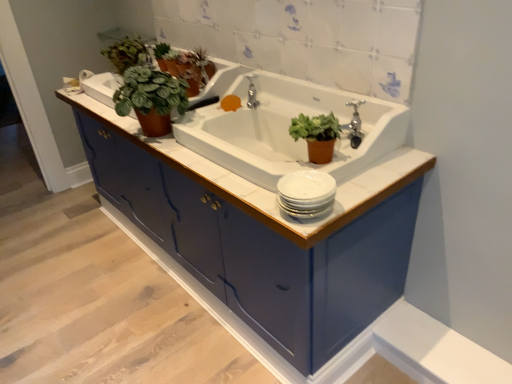
What is the approximate width of white glossy sink at center?

It is 48.31 centimeters.

Find the location of a particular element. The width and height of the screenshot is (512, 384). silver metallic tap at upper center is located at coordinates (252, 94).

At what (x,y) coordinates should I click in order to perform the action: click on matte brown pot at center, arranged as the first houseplant when viewed from the right. Please return your answer as a coordinate pair (x, y). Image resolution: width=512 pixels, height=384 pixels. Looking at the image, I should click on (317, 135).

The height and width of the screenshot is (384, 512). What do you see at coordinates (151, 98) in the screenshot? I see `green matte plant at upper left, the 2th houseplant positioned from the front` at bounding box center [151, 98].

Locate an element on the screen. The width and height of the screenshot is (512, 384). matte blue cabinet at center is located at coordinates (265, 189).

In the scene shown: Measure the distance between green matte plant at upper center and camera.

green matte plant at upper center is 1.78 meters away from camera.

The width and height of the screenshot is (512, 384). What do you see at coordinates (201, 64) in the screenshot?
I see `green matte plant at upper center` at bounding box center [201, 64].

I want to click on matte ceramic sink at center, so click(x=100, y=86).

Identify the location of white glossy sink at center. (287, 130).

Considering the positions of objects silver metallic tap at upper center and matte blue cabinet at center in the image provided, who is behind, silver metallic tap at upper center or matte blue cabinet at center?

silver metallic tap at upper center is behind.

Is silver metallic tap at upper center completely or partially outside of matte blue cabinet at center?

silver metallic tap at upper center is positioned outside matte blue cabinet at center.

Considering the positions of objects silver metallic tap at upper center and matte blue cabinet at center in the image provided, who is more to the left, silver metallic tap at upper center or matte blue cabinet at center?

matte blue cabinet at center.

Is point (250, 101) closer to viewer compared to point (105, 121)?

That is True.

Can you confirm if matte brown pot at center, which appears as the third houseplant when viewed from the back, is shorter than green matte plant at upper left, the 2th houseplant from the back?

Yes, matte brown pot at center, which appears as the third houseplant when viewed from the back, is shorter than green matte plant at upper left, the 2th houseplant from the back.

How many degrees apart are the facing directions of matte brown pot at center, the first houseplant in the front-to-back sequence, and green matte plant at upper left, which appears as the 2th houseplant when viewed from the top?

The angular difference between matte brown pot at center, the first houseplant in the front-to-back sequence, and green matte plant at upper left, which appears as the 2th houseplant when viewed from the top, is 1.41 degrees.

Would you say matte brown pot at center, arranged as the first houseplant when viewed from the right, is outside green matte plant at upper left, the 2th houseplant from the back?

matte brown pot at center, arranged as the first houseplant when viewed from the right, is positioned outside green matte plant at upper left, the 2th houseplant from the back.

Which object is closer to the camera, matte brown pot at center, the 1th houseplant from the bottom, or green matte plant at upper left, which appears as the 2th houseplant when viewed from the top?

matte brown pot at center, the 1th houseplant from the bottom, is more forward.

Does matte brown pot at center, the 1th houseplant from the bottom, turn towards matte ceramic sink at center?

No, matte brown pot at center, the 1th houseplant from the bottom, is not turned towards matte ceramic sink at center.

Which object is closer to the camera taking this photo, matte brown pot at center, which is the 3th houseplant from left to right, or matte ceramic sink at center?

matte brown pot at center, which is the 3th houseplant from left to right, is closer to the camera.

Based on their sizes in the image, would you say matte brown pot at center, arranged as the first houseplant when viewed from the right, is bigger or smaller than matte ceramic sink at center?

matte brown pot at center, arranged as the first houseplant when viewed from the right, is smaller than matte ceramic sink at center.

Is green matte plant at upper left, acting as the 3th houseplant starting from the right, at the left side of green matte plant at upper center?

Indeed, green matte plant at upper left, acting as the 3th houseplant starting from the right, is positioned on the left side of green matte plant at upper center.

From the picture: Which of these two, green matte plant at upper left, placed as the 1th houseplant when sorted from back to front, or green matte plant at upper center, is bigger?

Bigger between the two is green matte plant at upper left, placed as the 1th houseplant when sorted from back to front.

How much distance is there between green matte plant at upper left, the third houseplant positioned from the bottom, and green matte plant at upper center?

green matte plant at upper left, the third houseplant positioned from the bottom, is 13.00 inches away from green matte plant at upper center.

Is green matte plant at upper left, the first houseplant in the left-to-right sequence, next to green matte plant at upper center?

No, green matte plant at upper left, the first houseplant in the left-to-right sequence, is not beside green matte plant at upper center.

Could silver metallic tap at upper center be considered to be inside matte brown pot at center, which appears as the third houseplant when viewed from the back?

No, silver metallic tap at upper center is not a part of matte brown pot at center, which appears as the third houseplant when viewed from the back.

This screenshot has width=512, height=384. Find the location of `tap on the left of matte brown pot at center, arranged as the first houseplant when viewed from the right`. tap on the left of matte brown pot at center, arranged as the first houseplant when viewed from the right is located at coordinates (252, 94).

From a real-world perspective, is matte brown pot at center, which is counted as the 3th houseplant, starting from the top, physically above silver metallic tap at upper center?

Indeed, from a real-world perspective, matte brown pot at center, which is counted as the 3th houseplant, starting from the top, stands above silver metallic tap at upper center.

Is green matte plant at upper center placed right next to silver metallic tap at upper center?

No.

The height and width of the screenshot is (384, 512). I want to click on plant above the silver metallic tap at upper center (from a real-world perspective), so click(x=201, y=64).

Looking at the image, does green matte plant at upper center seem bigger or smaller compared to silver metallic tap at upper center?

Considering their sizes, green matte plant at upper center takes up more space than silver metallic tap at upper center.

From a real-world perspective, is green matte plant at upper center over silver metallic tap at upper center?

Yes, from a real-world perspective, green matte plant at upper center is above silver metallic tap at upper center.

Between green matte plant at upper left, which ranks as the 2th houseplant in bottom-to-top order, and matte blue cabinet at center, which one appears on the right side from the viewer's perspective?

matte blue cabinet at center.

Considering the sizes of objects green matte plant at upper left, which ranks as the second houseplant in left-to-right order, and matte blue cabinet at center in the image provided, who is taller, green matte plant at upper left, which ranks as the second houseplant in left-to-right order, or matte blue cabinet at center?

matte blue cabinet at center is taller.

Relative to matte blue cabinet at center, is green matte plant at upper left, the 2th houseplant in the right-to-left sequence, in front or behind?

green matte plant at upper left, the 2th houseplant in the right-to-left sequence, is behind matte blue cabinet at center.

Consider the image. Are green matte plant at upper left, the 2th houseplant positioned from the front, and matte blue cabinet at center located far from each other?

green matte plant at upper left, the 2th houseplant positioned from the front, is near matte blue cabinet at center, not far away.

This screenshot has height=384, width=512. In order to click on bathroom cabinet on the left of silver metallic tap at upper center in this screenshot , I will do `click(265, 189)`.

Where is `houseplant below the green matte plant at upper left, which ranks as the second houseplant in left-to-right order (from a real-world perspective)`? This screenshot has height=384, width=512. houseplant below the green matte plant at upper left, which ranks as the second houseplant in left-to-right order (from a real-world perspective) is located at coordinates (317, 135).

From the image, which object appears to be farther from green matte plant at upper center, matte ceramic sink at center or green matte plant at upper left, which ranks as the second houseplant in left-to-right order?

Among the two, matte ceramic sink at center is located further to green matte plant at upper center.

From the image, which object appears to be nearer to green matte plant at upper center, silver metallic tap at upper center or green matte plant at upper left, the first houseplant in the top-to-bottom sequence?

Based on the image, silver metallic tap at upper center appears to be nearer to green matte plant at upper center.

From the image, which object appears to be farther from matte ceramic sink at center, white glossy sink at center or green matte plant at upper center?

Among the two, white glossy sink at center is located further to matte ceramic sink at center.

Looking at the image, which one is located closer to matte brown pot at center, the first houseplant in the front-to-back sequence, green matte plant at upper center or green matte plant at upper left, which appears as the 2th houseplant when viewed from the top?

green matte plant at upper left, which appears as the 2th houseplant when viewed from the top, lies closer to matte brown pot at center, the first houseplant in the front-to-back sequence, than the other object.

Which object lies nearer to the anchor point green matte plant at upper left, which is counted as the 3th houseplant, starting from the front, green matte plant at upper center or silver metallic tap at upper center?

Among the two, green matte plant at upper center is located nearer to green matte plant at upper left, which is counted as the 3th houseplant, starting from the front.

Looking at the image, which one is located closer to matte blue cabinet at center, green matte plant at upper left, which is counted as the 3th houseplant, starting from the front, or green matte plant at upper left, which ranks as the second houseplant in left-to-right order?

green matte plant at upper left, which ranks as the second houseplant in left-to-right order, is positioned closer to the anchor matte blue cabinet at center.

Based on their spatial positions, is green matte plant at upper left, which is counted as the 3th houseplant, starting from the front, or green matte plant at upper center further from matte brown pot at center, arranged as the first houseplant when viewed from the right?

Based on the image, green matte plant at upper left, which is counted as the 3th houseplant, starting from the front, appears to be further to matte brown pot at center, arranged as the first houseplant when viewed from the right.

From the image, which object appears to be nearer to matte ceramic sink at center, matte brown pot at center, which appears as the third houseplant when viewed from the back, or green matte plant at upper left, acting as the 3th houseplant starting from the right?

Among the two, green matte plant at upper left, acting as the 3th houseplant starting from the right, is located nearer to matte ceramic sink at center.

Image resolution: width=512 pixels, height=384 pixels. I want to click on bath positioned between green matte plant at upper left, the 2th houseplant positioned from the front, and green matte plant at upper center from near to far, so click(x=100, y=86).

Image resolution: width=512 pixels, height=384 pixels. Find the location of `sink between green matte plant at upper left, which ranks as the 2th houseplant in bottom-to-top order, and matte brown pot at center, which is counted as the 3th houseplant, starting from the top, from left to right`. sink between green matte plant at upper left, which ranks as the 2th houseplant in bottom-to-top order, and matte brown pot at center, which is counted as the 3th houseplant, starting from the top, from left to right is located at coordinates (287, 130).

The width and height of the screenshot is (512, 384). Find the location of `bathroom cabinet between green matte plant at upper left, which ranks as the 2th houseplant in bottom-to-top order, and white glossy sink at center`. bathroom cabinet between green matte plant at upper left, which ranks as the 2th houseplant in bottom-to-top order, and white glossy sink at center is located at coordinates (265, 189).

Locate an element on the screen. tap between matte brown pot at center, arranged as the first houseplant when viewed from the right, and green matte plant at upper center in the front-back direction is located at coordinates (252, 94).